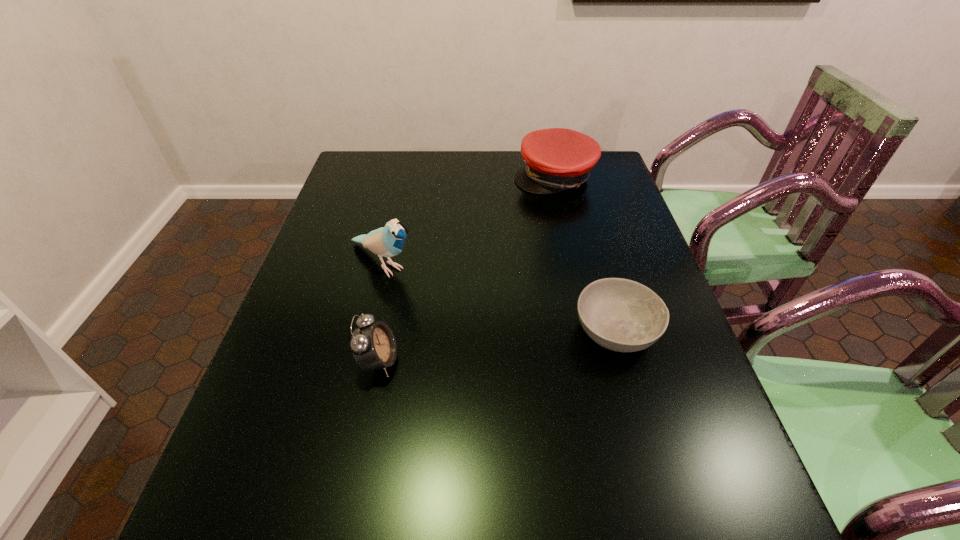
Where is `alarm clock`? The width and height of the screenshot is (960, 540). alarm clock is located at coordinates (373, 344).

Where is `bowl`? bowl is located at coordinates (622, 315).

The image size is (960, 540). In order to click on the farthest object in this screenshot , I will do `click(556, 159)`.

The height and width of the screenshot is (540, 960). I want to click on bird, so click(388, 241).

I want to click on the third nearest object, so click(x=388, y=241).

Where is `free region located 0.320m on the face of the alarm clock`? This screenshot has height=540, width=960. free region located 0.320m on the face of the alarm clock is located at coordinates pos(546,361).

Where is `vacant space situated 0.160m on the front of the bowl`? vacant space situated 0.160m on the front of the bowl is located at coordinates (646, 440).

Where is `blank space located on the front-facing side of the farthest object`? The height and width of the screenshot is (540, 960). blank space located on the front-facing side of the farthest object is located at coordinates (524, 241).

Locate an element on the screen. blank area located 0.230m on the front-facing side of the farthest object is located at coordinates (524, 241).

Identify the location of vacant space located 0.110m on the front-facing side of the farthest object. Image resolution: width=960 pixels, height=540 pixels. (535, 217).